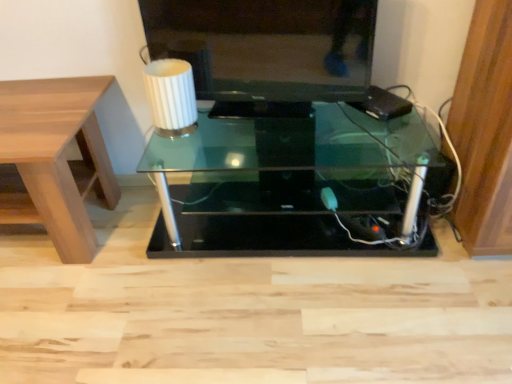
Where is `vacant space underneath matte black television at upper center (from a real-world perspective)`? The image size is (512, 384). vacant space underneath matte black television at upper center (from a real-world perspective) is located at coordinates (244, 107).